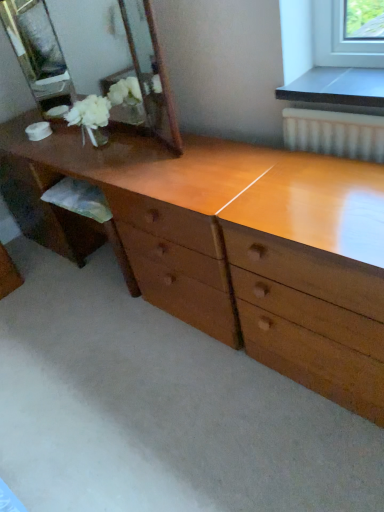
What are the coordinates of `vacant space in wooden mirror at upper left (from a real-world perspective)` in the screenshot? It's located at (122, 136).